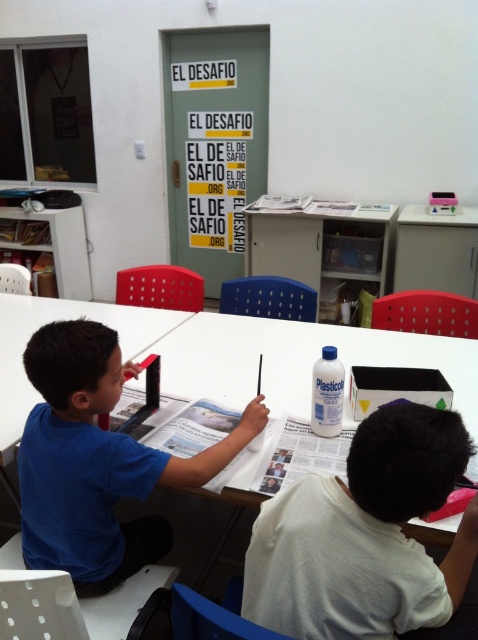
Question: Is white matte shirt at lower right further to camera compared to blue matte shirt at center?

Choices:
 (A) yes
 (B) no

Answer: (B)

Question: Is white matte shirt at lower right wider than blue matte shirt at center?

Choices:
 (A) no
 (B) yes

Answer: (A)

Question: Among these points, which one is farthest from the camera?

Choices:
 (A) (420, 548)
 (B) (43, 403)

Answer: (B)

Question: Is white matte shirt at lower right smaller than blue matte shirt at center?

Choices:
 (A) no
 (B) yes

Answer: (B)

Question: Which object appears closest to the camera in this image?

Choices:
 (A) blue matte shirt at center
 (B) white matte shirt at lower right

Answer: (B)